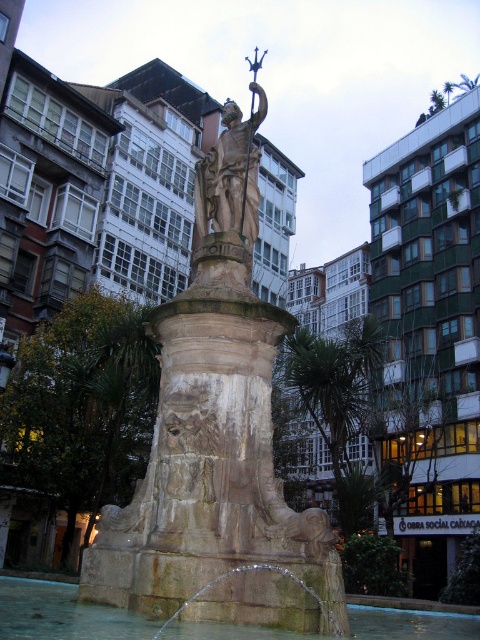
Question: Is stone fountain at center positioned before green leafy palm tree at center?

Choices:
 (A) yes
 (B) no

Answer: (A)

Question: Can you confirm if stone fountain at center is positioned below green leafy palm tree at center?

Choices:
 (A) yes
 (B) no

Answer: (B)

Question: Estimate the real-world distances between objects in this image. Which object is farther from the clear water at fountain center?

Choices:
 (A) green leafy palm tree at center
 (B) stone fountain at center

Answer: (A)

Question: Which point is farther to the camera?

Choices:
 (A) clear water at fountain center
 (B) stone fountain at center
 (C) green leafy palm tree at center

Answer: (C)

Question: Which point is farther to the camera?

Choices:
 (A) (212, 628)
 (B) (214, 429)
 (C) (301, 353)

Answer: (C)

Question: From the image, what is the correct spatial relationship of stone fountain at center in relation to green leafy palm tree at center?

Choices:
 (A) above
 (B) below

Answer: (A)